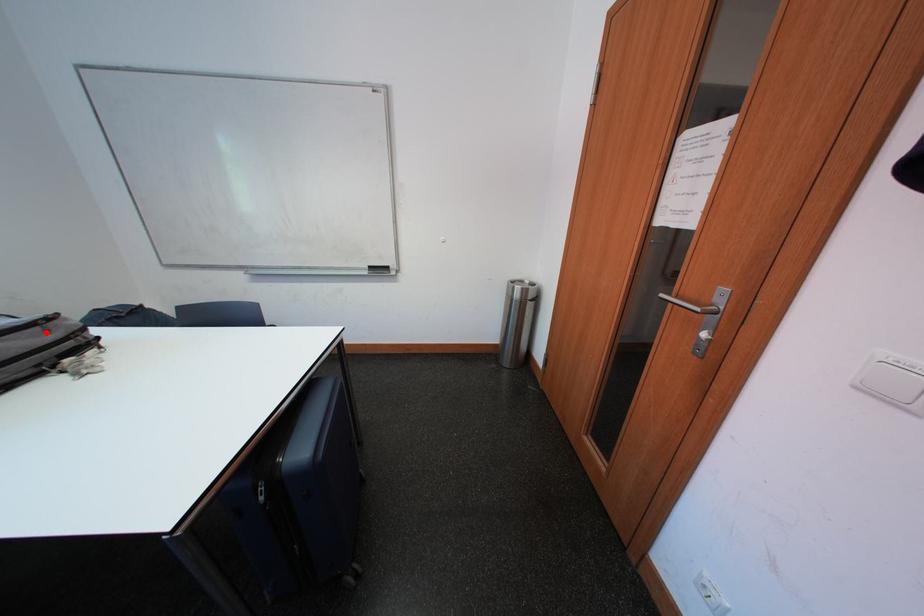
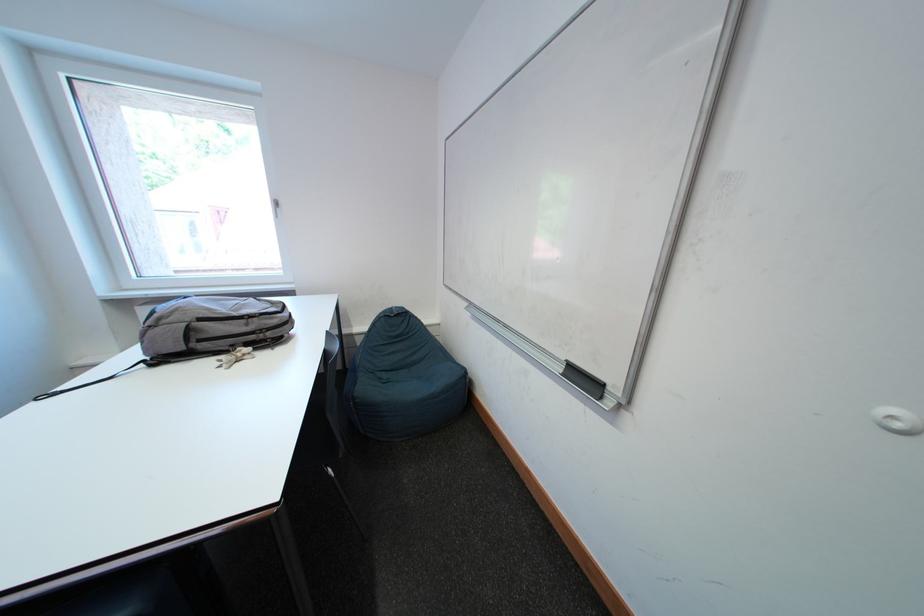
Where in the second image is the point corresponding to the highlighted location from the first image?

(252, 325)